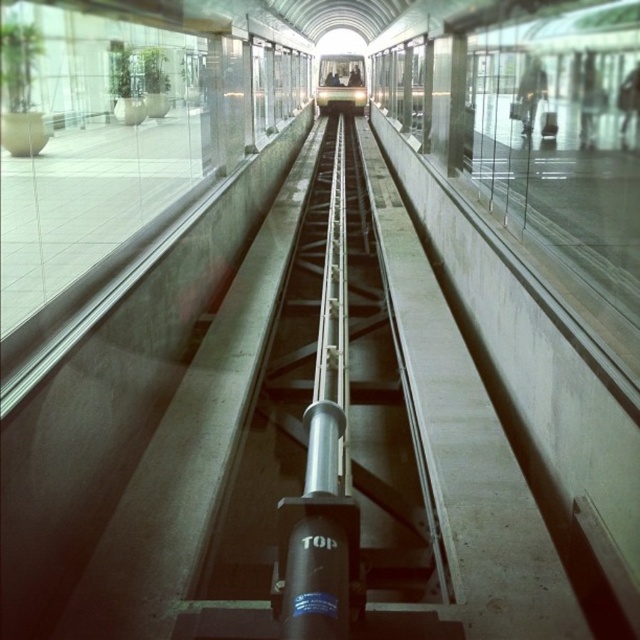
Question: Does silver metallic rail at center lie in front of metallic silver train at center?

Choices:
 (A) no
 (B) yes

Answer: (B)

Question: Which of the following is the closest to the observer?

Choices:
 (A) (333, 76)
 (B) (339, 275)

Answer: (B)

Question: Is silver metallic rail at center bigger than metallic silver train at center?

Choices:
 (A) yes
 (B) no

Answer: (A)

Question: Which of the following is the farthest from the observer?

Choices:
 (A) metallic silver train at center
 (B) silver metallic rail at center

Answer: (A)

Question: Which of the following is the closest to the observer?

Choices:
 (A) (316, 579)
 (B) (353, 83)

Answer: (A)

Question: Is silver metallic rail at center to the right of metallic silver train at center from the viewer's perspective?

Choices:
 (A) yes
 (B) no

Answer: (B)